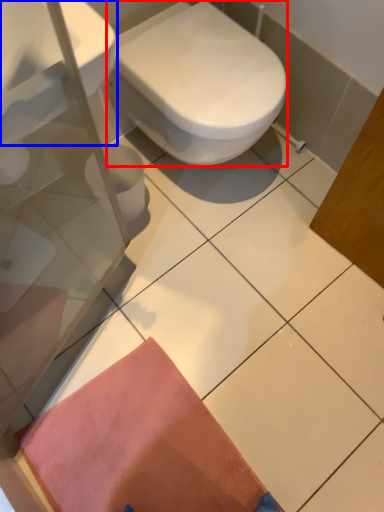
Question: Which of the following is the closest to the observer, bidet (highlighted by a red box) or sink (highlighted by a blue box)?

Choices:
 (A) bidet
 (B) sink

Answer: (B)